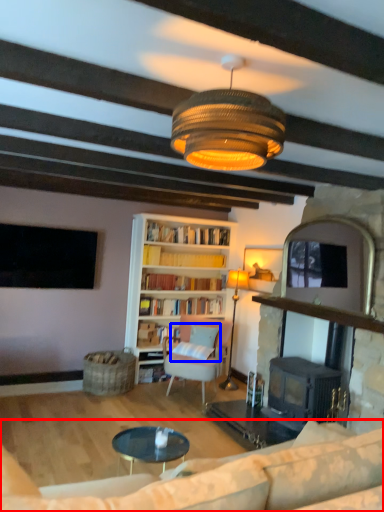
Question: Which of the following is the closest to the observer, studio couch (highlighted by a red box) or pillow (highlighted by a blue box)?

Choices:
 (A) studio couch
 (B) pillow

Answer: (A)